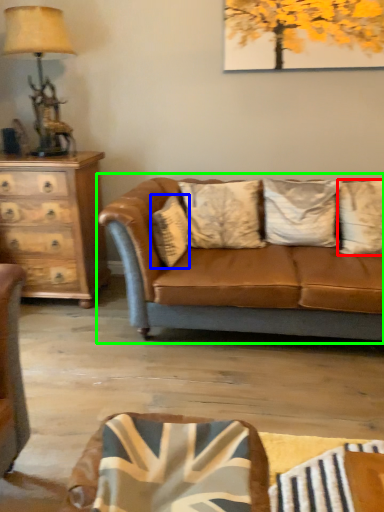
Question: Estimate the real-world distances between objects in this image. Which object is closer to pillow (highlighted by a red box), pillow (highlighted by a blue box) or studio couch (highlighted by a green box)?

Choices:
 (A) pillow
 (B) studio couch

Answer: (B)